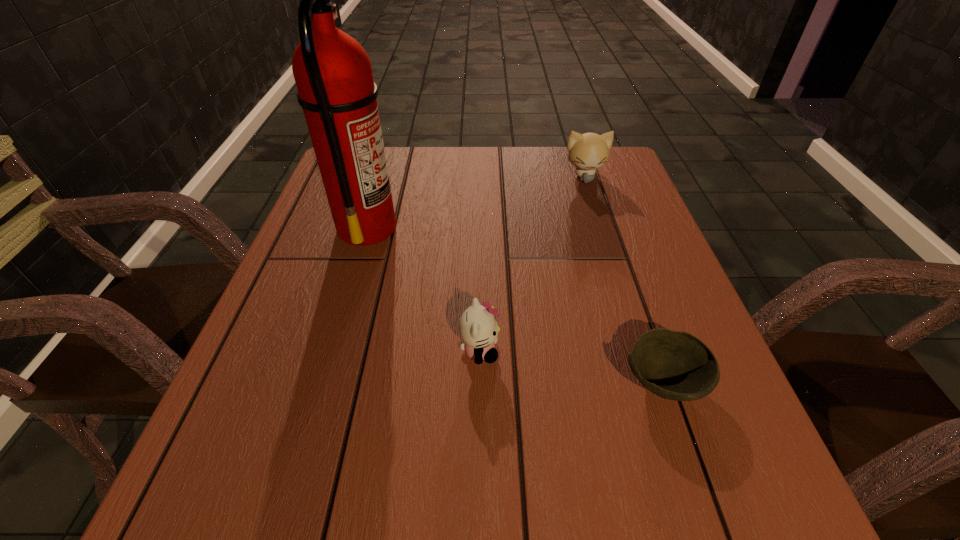
The image size is (960, 540). In the image, there is a desktop. Find the location of `vacant space at the far right corner`. vacant space at the far right corner is located at coordinates (604, 166).

At what (x,y) coordinates should I click in order to perform the action: click on empty space that is in between the nearer kitten and the leftmost object. Please return your answer as a coordinate pair (x, y). The height and width of the screenshot is (540, 960). Looking at the image, I should click on (423, 289).

At what (x,y) coordinates should I click in order to perform the action: click on free space between the nearer kitten and the right kitten. Please return your answer as a coordinate pair (x, y). Looking at the image, I should click on pyautogui.click(x=532, y=264).

Locate an element on the screen. unoccupied position between the leftmost object and the second tallest object is located at coordinates (476, 201).

Locate an element on the screen. vacant point located between the farthest object and the third object from right to left is located at coordinates (532, 264).

What are the coordinates of `free space between the farthest object and the leftmost object` in the screenshot? It's located at pyautogui.click(x=476, y=201).

Identify the location of blank region between the left kitten and the right kitten. The width and height of the screenshot is (960, 540). (532, 264).

At what (x,y) coordinates should I click in order to perform the action: click on empty space between the right kitten and the bowl. Please return your answer as a coordinate pair (x, y). This screenshot has width=960, height=540. Looking at the image, I should click on (624, 279).

Where is `vacant space that's between the bowl and the second object from left to right`? vacant space that's between the bowl and the second object from left to right is located at coordinates (571, 366).

Find the location of a particular element. Image resolution: width=960 pixels, height=540 pixels. free space between the bowl and the farthest object is located at coordinates (624, 279).